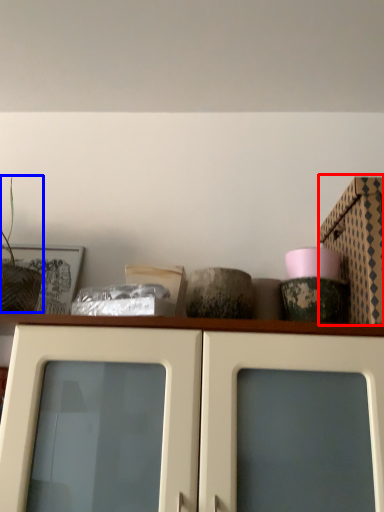
Question: Which object appears closest to the camera in this image, cardboard box (highlighted by a red box) or plant (highlighted by a blue box)?

Choices:
 (A) cardboard box
 (B) plant

Answer: (B)